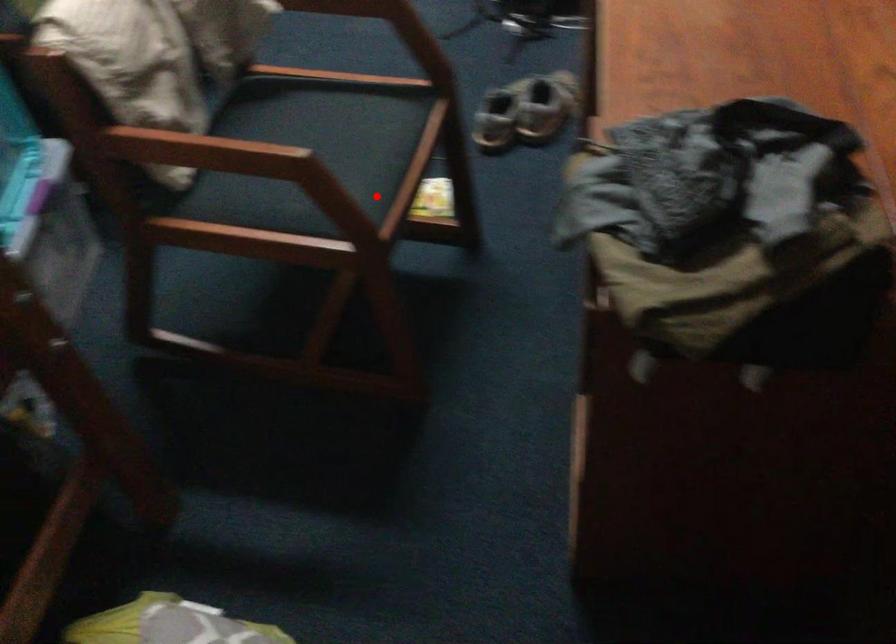
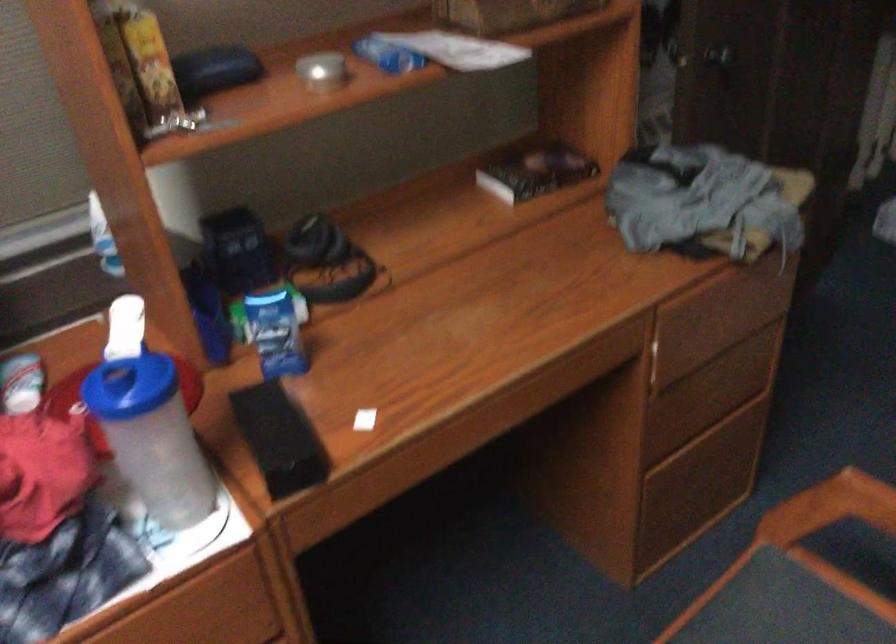
Question: I am providing you with two images of the same scene from different viewpoints. Image1 has a red point marked. In image2, the corresponding 3D location appears at what relative position? Reply with the corresponding letter.

Choices:
 (A) Closer
 (B) Farther

Answer: (A)